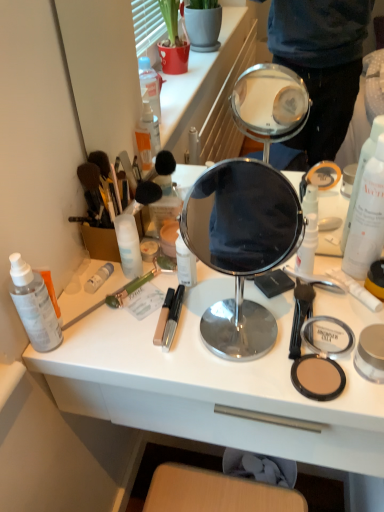
Where is `empty space that is to the right of green plastic brush at lower left`? This screenshot has height=512, width=384. empty space that is to the right of green plastic brush at lower left is located at coordinates (197, 311).